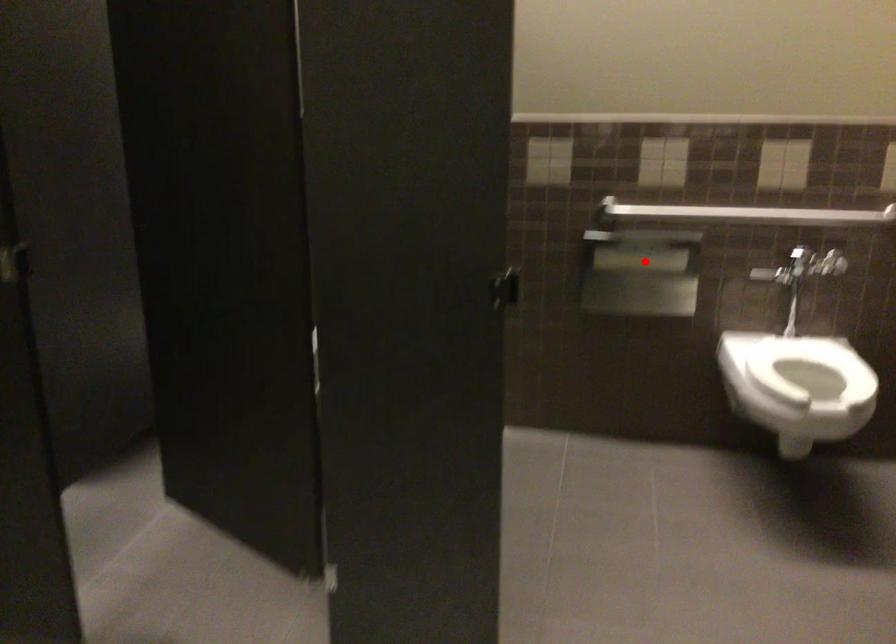
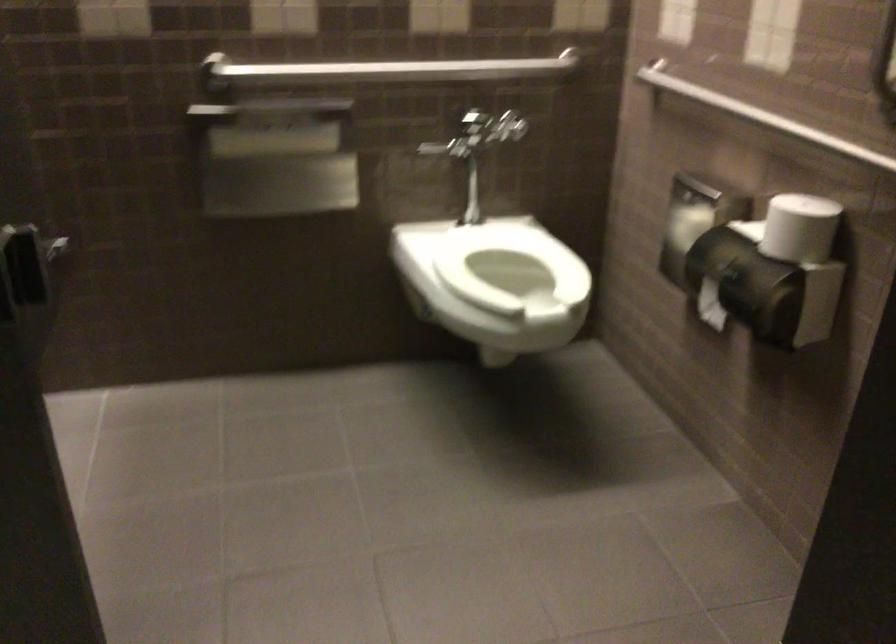
The point at the highlighted location is marked in the first image. Where is the corresponding point in the second image?

(273, 143)